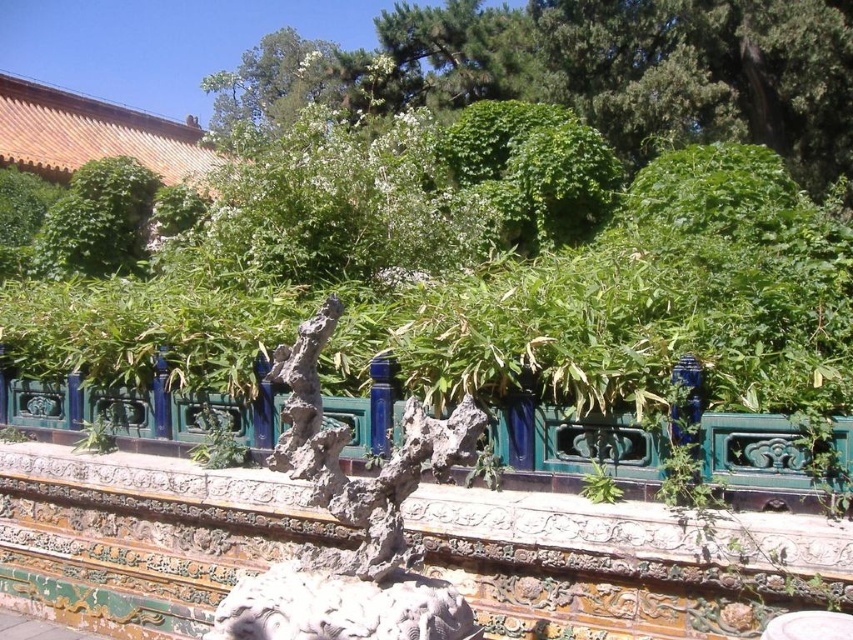
Question: Which point is farther to the camera?

Choices:
 (A) (120, 112)
 (B) (286, 625)

Answer: (A)

Question: Which point is closer to the camera?

Choices:
 (A) green glazed tile fence at center
 (B) green leafy bush at upper center

Answer: (A)

Question: Based on their relative distances, which object is nearer to the green leafy bush at upper left?

Choices:
 (A) green leafy tree at upper center
 (B) green leafy bush at upper center
 (C) green glazed tile fence at center
 (D) orange glazed tile roof at upper left

Answer: (D)

Question: Is green glazed tile fence at center to the left of green leafy bush at upper left from the viewer's perspective?

Choices:
 (A) no
 (B) yes

Answer: (A)

Question: Is green glazed tile fence at center bigger than green leafy bush at upper left?

Choices:
 (A) yes
 (B) no

Answer: (B)

Question: Does green leafy bush at upper left lie in front of green leafy tree at upper center?

Choices:
 (A) yes
 (B) no

Answer: (B)